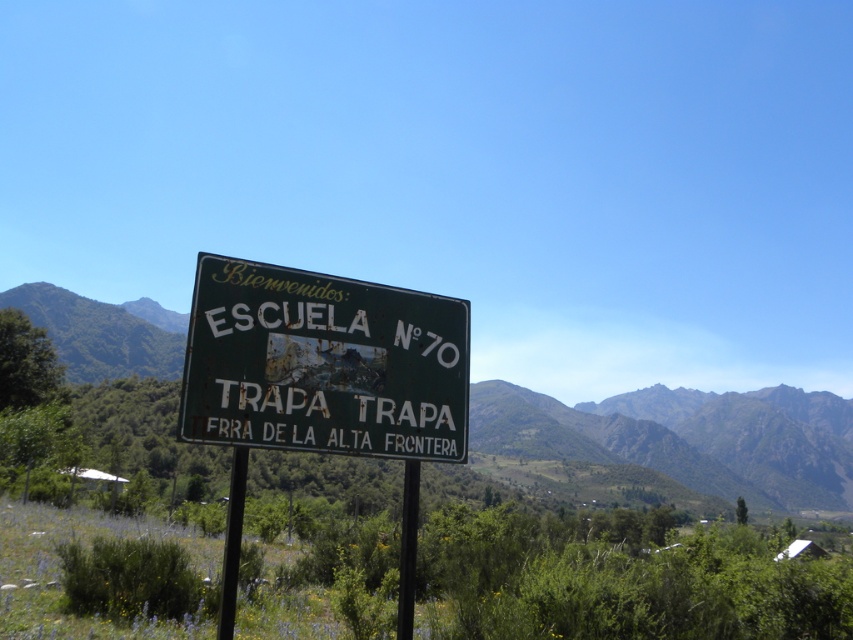
Question: Considering the real-world distances, which object is farthest from the metallic pole at center?

Choices:
 (A) green grassy mountain at center
 (B) black metal pole at center

Answer: (A)

Question: Which point is closer to the camera?

Choices:
 (A) (166, 324)
 (B) (408, 550)
 (C) (222, 637)
 (D) (434, 451)

Answer: (C)

Question: Can you confirm if green grassy mountain at center is smaller than metallic pole at center?

Choices:
 (A) no
 (B) yes

Answer: (A)

Question: Does metallic pole at center appear under black metal pole at center?

Choices:
 (A) yes
 (B) no

Answer: (A)

Question: Which is farther from the green grassy mountain at center?

Choices:
 (A) rusty metal sign at center
 (B) black metal pole at center

Answer: (B)

Question: Is rusty metal sign at center above metallic pole at center?

Choices:
 (A) no
 (B) yes

Answer: (B)